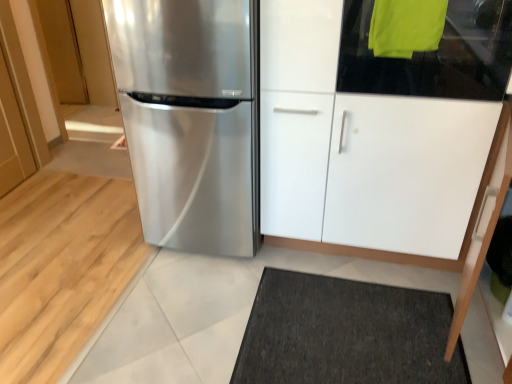
Question: Is transparent glass door at upper right inside the boundaries of white glossy cabinet at center, or outside?

Choices:
 (A) inside
 (B) outside

Answer: (A)

Question: In terms of size, does transparent glass door at upper right appear bigger or smaller than white glossy cabinet at center?

Choices:
 (A) big
 (B) small

Answer: (B)

Question: Which is farther from the satin metallic refrigerator at center?

Choices:
 (A) transparent glass door at upper right
 (B) white glossy cabinet at center

Answer: (A)

Question: Estimate the real-world distances between objects in this image. Which object is closer to the transparent glass door at upper right?

Choices:
 (A) satin metallic refrigerator at center
 (B) white glossy cabinet at center

Answer: (B)